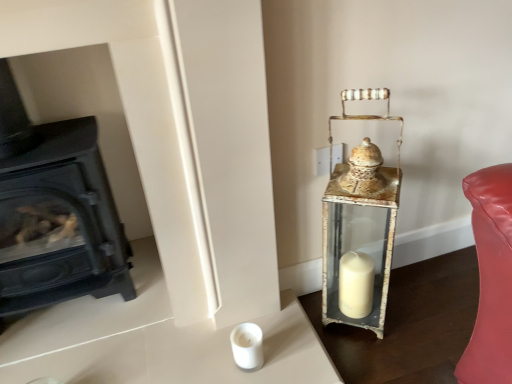
Where is `vacant space in front of antique brass lantern at right`? This screenshot has width=512, height=384. vacant space in front of antique brass lantern at right is located at coordinates (378, 358).